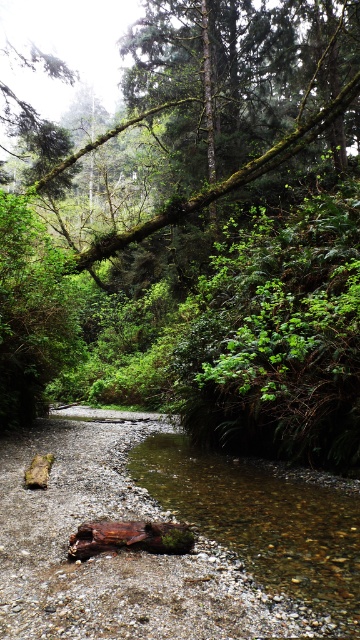
Question: Which of the following is the closest to the observer?

Choices:
 (A) green mossy branch at upper center
 (B) clear water at stream center

Answer: (B)

Question: Is green mossy branch at upper center positioned at the back of clear water at stream center?

Choices:
 (A) no
 (B) yes

Answer: (B)

Question: Which object appears farthest from the camera in this image?

Choices:
 (A) clear water at stream center
 (B) green mossy branch at upper center

Answer: (B)

Question: Among these objects, which one is farthest from the camera?

Choices:
 (A) clear water at stream center
 (B) green mossy branch at upper center

Answer: (B)

Question: Where is green mossy branch at upper center located in relation to clear water at stream center in the image?

Choices:
 (A) below
 (B) above

Answer: (B)

Question: Is green mossy branch at upper center positioned before clear water at stream center?

Choices:
 (A) yes
 (B) no

Answer: (B)